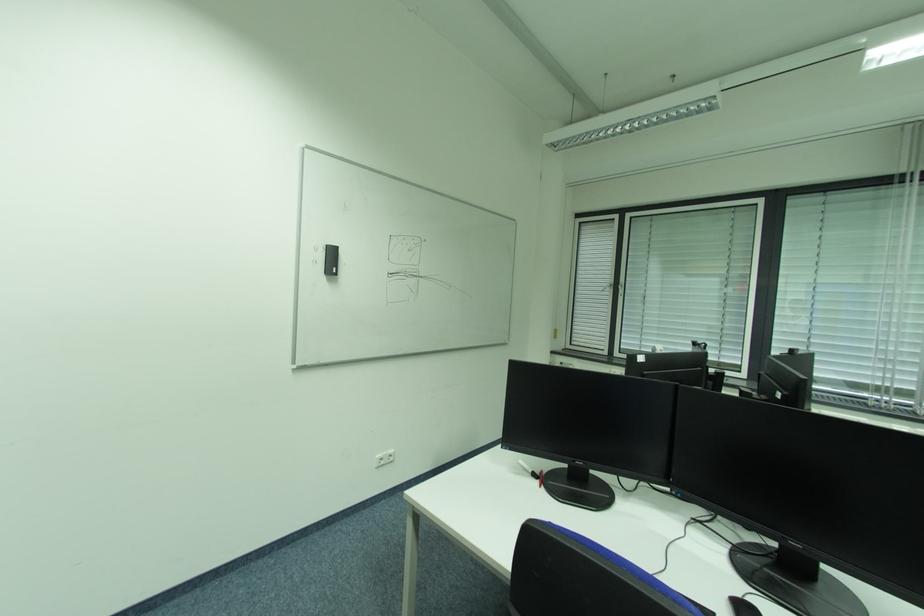
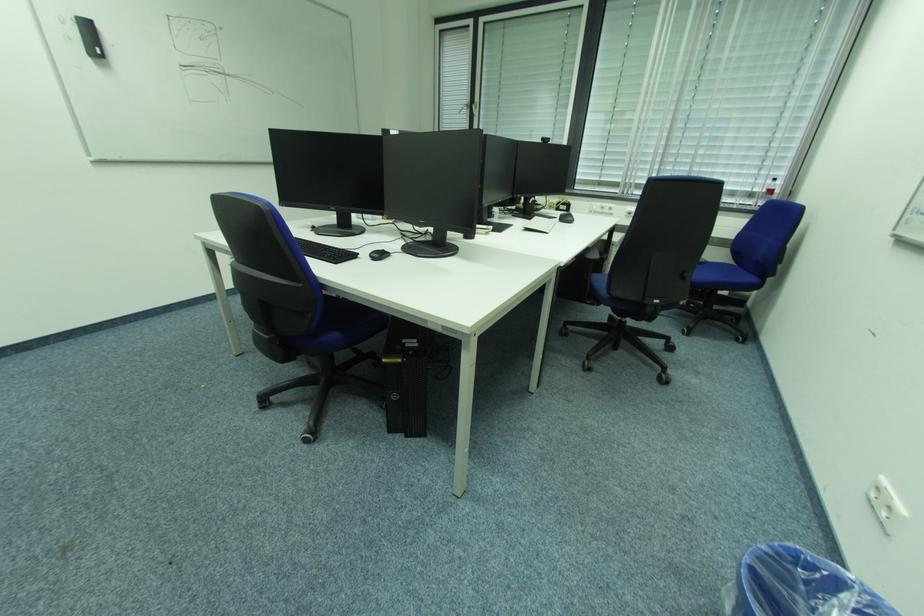
In a continuous first-person perspective shot, in which direction is the camera moving?

The cameraman walked toward right, backward.